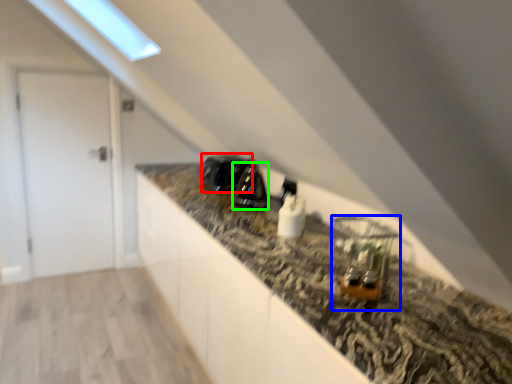
Question: Which is nearer to the appliance (highlighted by a red box)? appliance (highlighted by a blue box) or appliance (highlighted by a green box).

Choices:
 (A) appliance
 (B) appliance

Answer: (B)